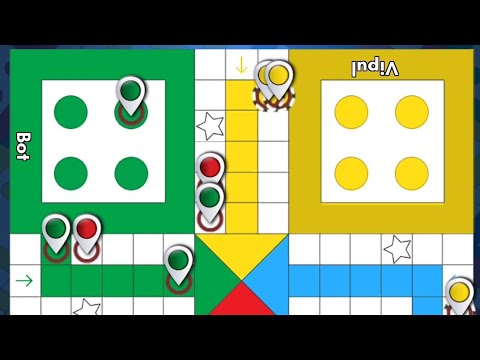
The height and width of the screenshot is (360, 480). What are the coordinates of `board game` in the screenshot? It's located at (178, 200).